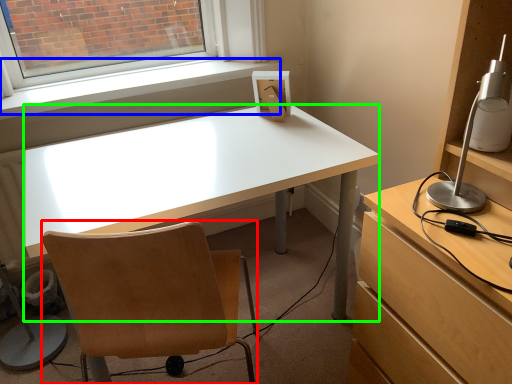
Question: Considering the real-world distances, which object is farthest from chair (highlighted by a red box)? window sill (highlighted by a blue box) or desk (highlighted by a green box)?

Choices:
 (A) window sill
 (B) desk

Answer: (A)